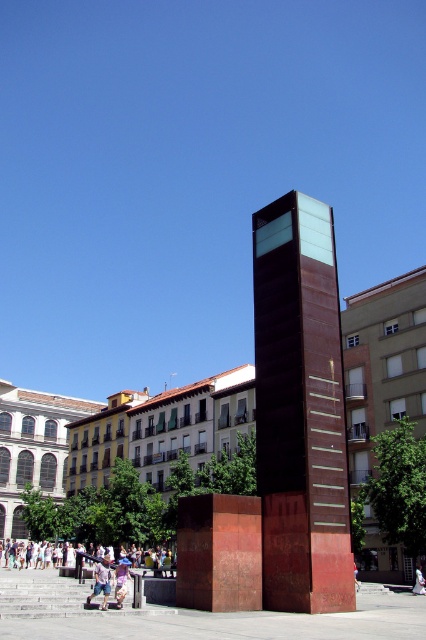
Between rustic metal tower at center and light blue denim jeans at lower center, which one appears on the left side from the viewer's perspective?

Positioned to the left is light blue denim jeans at lower center.

Is the position of rustic metal tower at center more distant than that of light blue denim jeans at lower center?

No, it is in front of light blue denim jeans at lower center.

Is point (293, 397) more distant than point (98, 563)?

No, (293, 397) is closer to viewer.

Locate an element on the screen. rustic metal tower at center is located at coordinates (299, 410).

Who is more forward, (106, 596) or (117, 596)?

Point (106, 596) is in front.

Is light blue denim jeans at lower center taller than light purple cotton dress at lower center?

Incorrect, light blue denim jeans at lower center's height is not larger of light purple cotton dress at lower center's.

Is point (109, 573) behind point (129, 560)?

That is False.

Find the location of a particular element. light blue denim jeans at lower center is located at coordinates point(101,580).

Does rustic metal tower at center appear on the right side of light purple cotton dress at lower center?

Correct, you'll find rustic metal tower at center to the right of light purple cotton dress at lower center.

Where is `rustic metal tower at center`? The width and height of the screenshot is (426, 640). rustic metal tower at center is located at coordinates (299, 410).

I want to click on rustic metal tower at center, so click(x=299, y=410).